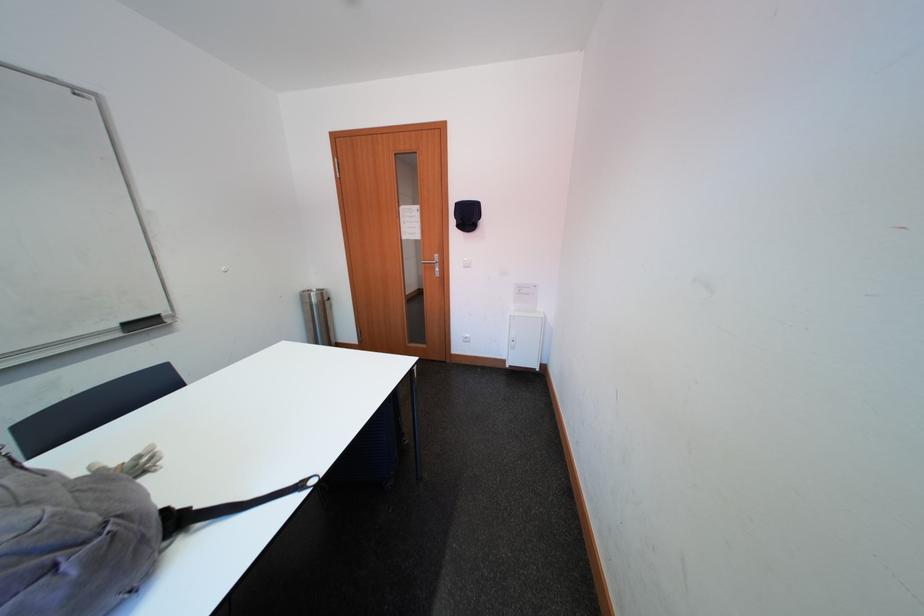
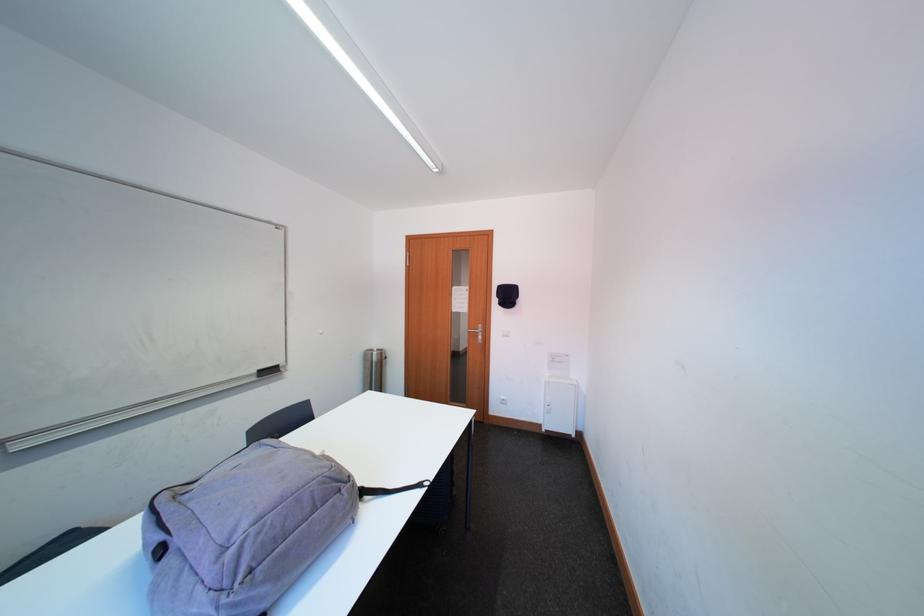
Find the pixel in the second image that matches pixel 64 572 in the first image.

(349, 493)